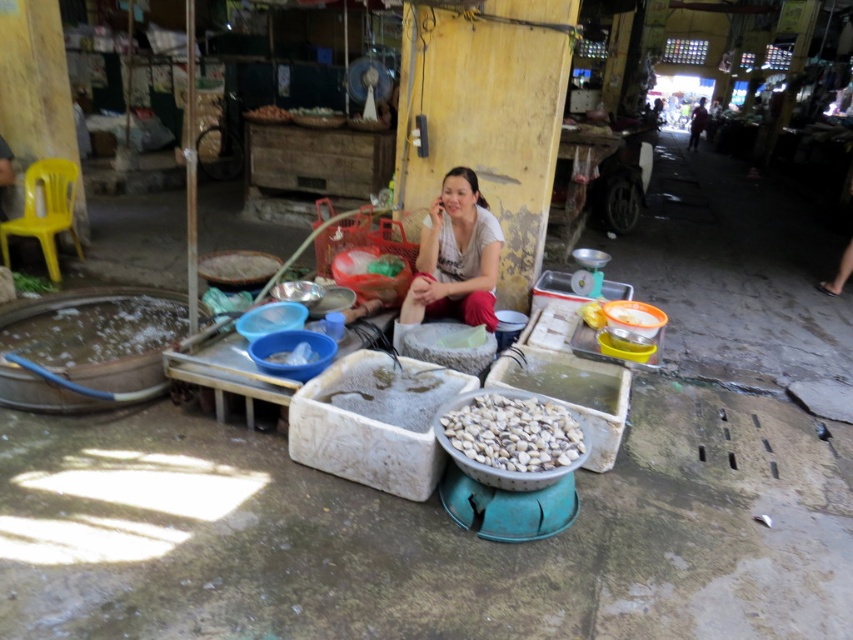
Is white cotton shirt at center to the left of white matte bowl at center from the viewer's perspective?

Correct, you'll find white cotton shirt at center to the left of white matte bowl at center.

Does point (428, 317) come closer to viewer compared to point (563, 429)?

That is False.

At what (x,y) coordinates should I click in order to perform the action: click on white cotton shirt at center. Please return your answer as a coordinate pair (x, y). Image resolution: width=853 pixels, height=640 pixels. Looking at the image, I should click on (456, 257).